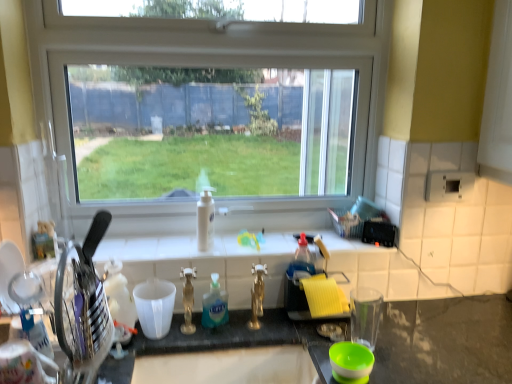
What is the approximate height of yellow sponge at right, which ranks as the 1th appliance in right-to-left order?

9.69 inches.

I want to click on white glossy bottle at center, which is counted as the first bottle, starting from the back, so click(x=205, y=219).

Find the location of a particular element. translucent plastic bottle at center, which is the 1th bottle in bottom-to-top order is located at coordinates (215, 305).

The height and width of the screenshot is (384, 512). Describe the element at coordinates (351, 362) in the screenshot. I see `green plastic bowl at lower center` at that location.

Identify the location of white tile at center. This screenshot has height=384, width=512. (193, 249).

Considering the sizes of white glossy bottle at center, the 2th bottle in the front-to-back sequence, and translucent plastic bottle at center, which is the 2th bottle from back to front, in the image, is white glossy bottle at center, the 2th bottle in the front-to-back sequence, taller or shorter than translucent plastic bottle at center, which is the 2th bottle from back to front,?

In the image, white glossy bottle at center, the 2th bottle in the front-to-back sequence, appears to be taller than translucent plastic bottle at center, which is the 2th bottle from back to front.

Can you see white glossy bottle at center, the 2th bottle in the front-to-back sequence, touching translucent plastic bottle at center, the first bottle in the front-to-back sequence?

No, white glossy bottle at center, the 2th bottle in the front-to-back sequence, is not beside translucent plastic bottle at center, the first bottle in the front-to-back sequence.

What's the angular difference between white glossy bottle at center, which ranks as the second bottle in bottom-to-top order, and translucent plastic bottle at center, the first bottle in the front-to-back sequence,'s facing directions?

The facing directions of white glossy bottle at center, which ranks as the second bottle in bottom-to-top order, and translucent plastic bottle at center, the first bottle in the front-to-back sequence, are 17 degrees apart.

Can you confirm if translucent plastic bottle at center, which is the 2th bottle from back to front, is positioned to the left of transparent glass window at center?

Incorrect, translucent plastic bottle at center, which is the 2th bottle from back to front, is not on the left side of transparent glass window at center.

From a real-world perspective, does translucent plastic bottle at center, the first bottle in the front-to-back sequence, sit lower than transparent glass window at center?

Yes.

Can you tell me how much translucent plastic bottle at center, which is the 1th bottle in bottom-to-top order, and transparent glass window at center differ in facing direction?

16.6 degrees separate the facing orientations of translucent plastic bottle at center, which is the 1th bottle in bottom-to-top order, and transparent glass window at center.

Find the location of a particular element. The width and height of the screenshot is (512, 384). bottle lying in front of the transparent glass window at center is located at coordinates (215, 305).

Is transparent glass window at center not close to white tile at center?

No, transparent glass window at center is not far from white tile at center.

Between transparent glass window at center and white tile at center, which one has more height?

transparent glass window at center is taller.

In the scene shown: Is transparent glass window at center to the left or to the right of white tile at center in the image?

In the image, transparent glass window at center appears on the left side of white tile at center.

Is point (338, 369) in front of point (298, 283)?

Yes, point (338, 369) is closer to viewer.

Where is `basin below the yellow sponge at right, positioned as the 1th appliance in back-to-front order (from a real-world perspective)`? basin below the yellow sponge at right, positioned as the 1th appliance in back-to-front order (from a real-world perspective) is located at coordinates (351, 362).

Can yellow sponge at right, positioned as the 1th appliance in back-to-front order, be found inside green plastic bowl at lower center?

No, yellow sponge at right, positioned as the 1th appliance in back-to-front order, is located outside of green plastic bowl at lower center.

Does green plastic bowl at lower center have a greater height compared to yellow sponge at right, which ranks as the 1th appliance in right-to-left order?

No.

Consider the image. Considering the relative sizes of metallic knife block at left, marked as the 2th appliance in a back-to-front arrangement, and translucent plastic bottle at center, which is the 1th bottle in bottom-to-top order, in the image provided, is metallic knife block at left, marked as the 2th appliance in a back-to-front arrangement, wider than translucent plastic bottle at center, which is the 1th bottle in bottom-to-top order,?

Indeed, metallic knife block at left, marked as the 2th appliance in a back-to-front arrangement, has a greater width compared to translucent plastic bottle at center, which is the 1th bottle in bottom-to-top order.

From the image's perspective, who appears lower, metallic knife block at left, marked as the 2th appliance in a back-to-front arrangement, or translucent plastic bottle at center, which is the 2th bottle from back to front?

translucent plastic bottle at center, which is the 2th bottle from back to front, from the image's perspective.

Would you consider metallic knife block at left, which is the second appliance from right to left, to be distant from translucent plastic bottle at center, which is the 2th bottle from back to front?

No, metallic knife block at left, which is the second appliance from right to left, is not far from translucent plastic bottle at center, which is the 2th bottle from back to front.

From a real-world perspective, is metallic knife block at left, marked as the 2th appliance in a back-to-front arrangement, physically below translucent plastic bottle at center, the first bottle in the front-to-back sequence?

No, from a real-world perspective, metallic knife block at left, marked as the 2th appliance in a back-to-front arrangement, is not beneath translucent plastic bottle at center, the first bottle in the front-to-back sequence.

Does metallic knife block at left, the 1th appliance in the left-to-right sequence, have a greater width compared to transparent glass window at center?

Yes.

Who is shorter, metallic knife block at left, which is the 1th appliance from front to back, or transparent glass window at center?

With less height is metallic knife block at left, which is the 1th appliance from front to back.

How far apart are metallic knife block at left, marked as the 2th appliance in a back-to-front arrangement, and transparent glass window at center?

metallic knife block at left, marked as the 2th appliance in a back-to-front arrangement, and transparent glass window at center are 25.95 inches apart from each other.

Is metallic knife block at left, which is the 1th appliance from front to back, not close to transparent glass window at center?

No, there isn't a large distance between metallic knife block at left, which is the 1th appliance from front to back, and transparent glass window at center.

From the image's perspective, which object appears higher, white glossy bottle at center, which ranks as the second bottle in bottom-to-top order, or metallic knife block at left, which is the second appliance from right to left?

white glossy bottle at center, which ranks as the second bottle in bottom-to-top order, appears higher in the image.

How many degrees apart are the facing directions of white glossy bottle at center, which is counted as the first bottle, starting from the back, and metallic knife block at left, which is the 1th appliance from front to back?

They differ by 93.8 degrees in their facing directions.

Who is bigger, white glossy bottle at center, the 2th bottle in the front-to-back sequence, or metallic knife block at left, marked as the 2th appliance in a back-to-front arrangement?

metallic knife block at left, marked as the 2th appliance in a back-to-front arrangement.

Is white glossy bottle at center, the 2th bottle in the front-to-back sequence, with metallic knife block at left, marked as the 2th appliance in a back-to-front arrangement?

No, white glossy bottle at center, the 2th bottle in the front-to-back sequence, is not making contact with metallic knife block at left, marked as the 2th appliance in a back-to-front arrangement.

Locate an element on the screen. bottle lying on the left of translucent plastic bottle at center, the first bottle in the front-to-back sequence is located at coordinates (205, 219).

Where is `bottle in front of the transparent glass window at center`? This screenshot has width=512, height=384. bottle in front of the transparent glass window at center is located at coordinates (215, 305).

Considering their positions, is translucent plastic bottle at center, the first bottle in the front-to-back sequence, positioned closer to yellow sponge at right, marked as the 2th appliance in a left-to-right arrangement, than white glossy bottle at center, the 2th bottle in the front-to-back sequence?

translucent plastic bottle at center, the first bottle in the front-to-back sequence, lies closer to yellow sponge at right, marked as the 2th appliance in a left-to-right arrangement, than the other object.

Which object lies further to the anchor point white tile at center, green plastic bowl at lower center or metallic knife block at left, marked as the 2th appliance in a back-to-front arrangement?

Based on the image, green plastic bowl at lower center appears to be further to white tile at center.

From the image, which object appears to be farther from green plastic bowl at lower center, white glossy bottle at center, which appears as the first bottle when viewed from the top, or translucent plastic bottle at center, which is the 2th bottle from back to front?

Based on the image, white glossy bottle at center, which appears as the first bottle when viewed from the top, appears to be further to green plastic bowl at lower center.

From the image, which object appears to be farther from metallic knife block at left, marked as the 2th appliance in a back-to-front arrangement, translucent plastic bottle at center, which is the 1th bottle in bottom-to-top order, or yellow sponge at right, the 2th appliance positioned from the front?

Based on the image, yellow sponge at right, the 2th appliance positioned from the front, appears to be further to metallic knife block at left, marked as the 2th appliance in a back-to-front arrangement.

Which object lies further to the anchor point green plastic bowl at lower center, yellow sponge at right, the 2th appliance positioned from the front, or transparent glass window at center?

Based on the image, transparent glass window at center appears to be further to green plastic bowl at lower center.

From the image, which object appears to be farther from yellow sponge at right, the 2th appliance positioned from the front, white tile at center or transparent glass window at center?

transparent glass window at center.

Based on the photo, when comparing their distances from green plastic bowl at lower center, does metallic knife block at left, which is the 1th appliance from front to back, or translucent plastic bottle at center, the first bottle in the front-to-back sequence, seem further?

Based on the image, metallic knife block at left, which is the 1th appliance from front to back, appears to be further to green plastic bowl at lower center.

Estimate the real-world distances between objects in this image. Which object is further from translucent plastic bottle at center, the 2th bottle positioned from the top, green plastic bowl at lower center or transparent glass window at center?

Based on the image, transparent glass window at center appears to be further to translucent plastic bottle at center, the 2th bottle positioned from the top.

Locate an element on the screen. window sill positioned between metallic knife block at left, which is the second appliance from right to left, and white glossy bottle at center, which appears as the first bottle when viewed from the top, from near to far is located at coordinates (193, 249).

I want to click on appliance situated between white tile at center and green plastic bowl at lower center from left to right, so click(x=300, y=294).

I want to click on window sill between transparent glass window at center and yellow sponge at right, which ranks as the 1th appliance in right-to-left order, in the up-down direction, so click(193, 249).

In order to click on window sill between white glossy bottle at center, the 2th bottle in the front-to-back sequence, and yellow sponge at right, positioned as the 1th appliance in back-to-front order in this screenshot , I will do `click(193, 249)`.